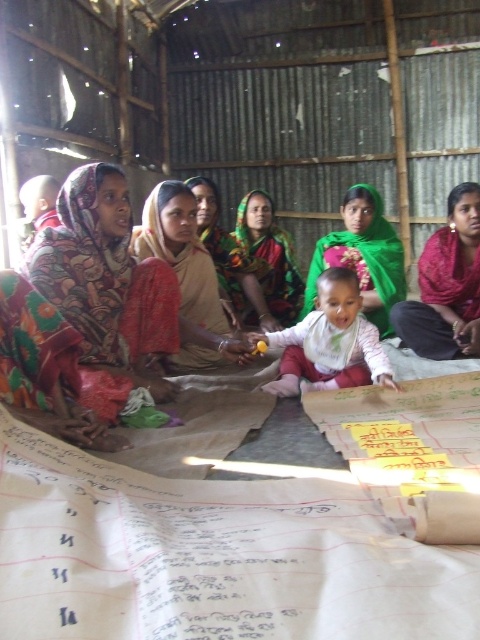
Question: Where is white soft baby at center located in relation to green fabric at center in the image?

Choices:
 (A) below
 (B) above

Answer: (A)

Question: Which of the following is the farthest from the observer?

Choices:
 (A) green fabric headscarf at center
 (B) beige fabric scarf at center
 (C) white soft baby at center

Answer: (A)

Question: Is printed fabric headscarf at center smaller than beige fabric scarf at center?

Choices:
 (A) no
 (B) yes

Answer: (A)

Question: Is red fabric headscarf at center to the left of beige fabric scarf at center from the viewer's perspective?

Choices:
 (A) yes
 (B) no

Answer: (B)

Question: Which object is the farthest from the green fabric headscarf at center?

Choices:
 (A) green fabric at center
 (B) beige fabric scarf at center

Answer: (B)

Question: Estimate the real-world distances between objects in this image. Which object is farther from the white soft baby at center?

Choices:
 (A) green fabric at center
 (B) green fabric headscarf at center
 (C) beige fabric scarf at center

Answer: (B)